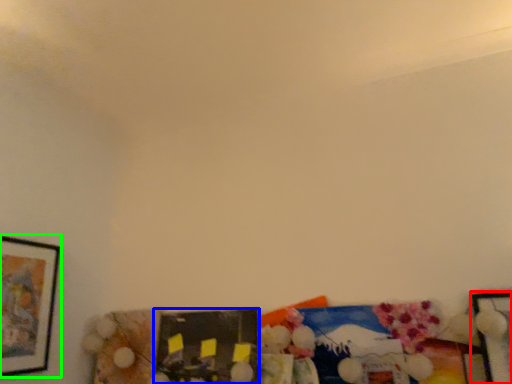
Question: Which object is the farthest from picture frame (highlighted by a red box)? Choose among these: picture frame (highlighted by a blue box) or picture frame (highlighted by a green box).

Choices:
 (A) picture frame
 (B) picture frame

Answer: (B)